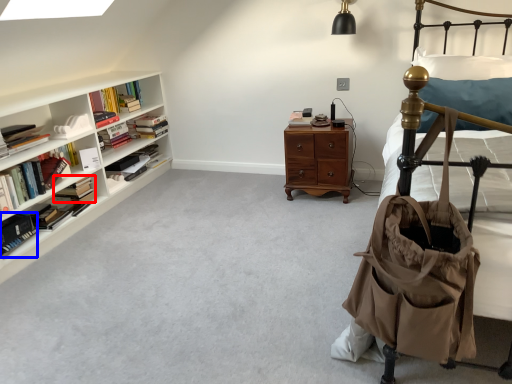
Question: Which object is further to the camera taking this photo, book (highlighted by a red box) or book (highlighted by a blue box)?

Choices:
 (A) book
 (B) book

Answer: (A)